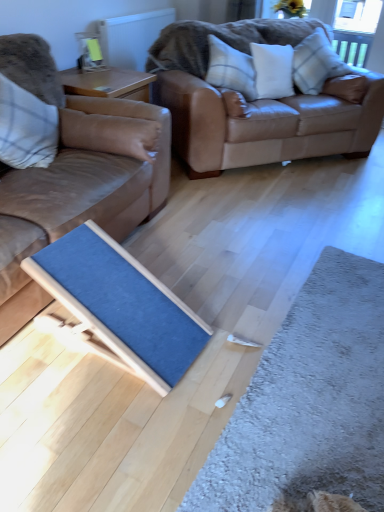
Question: Can you confirm if clear glass window screen at upper right is taller than plaid fabric pillow at upper right, placed as the 1th pillow when sorted from right to left?

Choices:
 (A) yes
 (B) no

Answer: (A)

Question: Can you confirm if clear glass window screen at upper right is shorter than plaid fabric pillow at upper right, which is the fourth pillow in left-to-right order?

Choices:
 (A) yes
 (B) no

Answer: (B)

Question: Is clear glass window screen at upper right closer to the viewer compared to plaid fabric pillow at upper right, which is the fourth pillow in left-to-right order?

Choices:
 (A) yes
 (B) no

Answer: (B)

Question: Is clear glass window screen at upper right not near plaid fabric pillow at upper right, which is the fourth pillow in left-to-right order?

Choices:
 (A) no
 (B) yes

Answer: (B)

Question: Can you see clear glass window screen at upper right touching plaid fabric pillow at upper right, which is the fourth pillow in left-to-right order?

Choices:
 (A) no
 (B) yes

Answer: (A)

Question: From a real-world perspective, is white textured radiator at upper center physically located above or below brown leather couch at upper center, which ranks as the 2th studio couch in left-to-right order?

Choices:
 (A) below
 (B) above

Answer: (B)

Question: Is white textured radiator at upper center taller or shorter than brown leather couch at upper center, which ranks as the 2th studio couch in left-to-right order?

Choices:
 (A) short
 (B) tall

Answer: (A)

Question: Looking at the image, does white textured radiator at upper center seem bigger or smaller compared to brown leather couch at upper center, which ranks as the 2th studio couch in left-to-right order?

Choices:
 (A) small
 (B) big

Answer: (A)

Question: Considering the relative positions of white textured radiator at upper center and brown leather couch at upper center, placed as the 1th studio couch when sorted from right to left, in the image provided, is white textured radiator at upper center to the left or to the right of brown leather couch at upper center, placed as the 1th studio couch when sorted from right to left,?

Choices:
 (A) left
 (B) right

Answer: (A)

Question: From the image's perspective, is plaid fabric pillow at upper right, which is the fourth pillow in left-to-right order, above or below matte brown leather couch at left, positioned as the second studio couch in right-to-left order?

Choices:
 (A) below
 (B) above

Answer: (B)

Question: In the image, is plaid fabric pillow at upper right, placed as the 1th pillow when sorted from right to left, positioned in front of or behind matte brown leather couch at left, which is the 1th studio couch in left-to-right order?

Choices:
 (A) behind
 (B) front

Answer: (A)

Question: In the image, is plaid fabric pillow at upper right, placed as the 1th pillow when sorted from right to left, on the left side or the right side of matte brown leather couch at left, positioned as the second studio couch in right-to-left order?

Choices:
 (A) left
 (B) right

Answer: (B)

Question: From a real-world perspective, relative to matte brown leather couch at left, which is the 1th studio couch in left-to-right order, is plaid fabric pillow at upper right, placed as the 1th pillow when sorted from right to left, vertically above or below?

Choices:
 (A) below
 (B) above

Answer: (B)

Question: Is matte brown leather couch at left, which is the 1th studio couch in left-to-right order, inside or outside of plaid fabric pillow at left, acting as the first pillow starting from the left?

Choices:
 (A) inside
 (B) outside

Answer: (B)

Question: Is matte brown leather couch at left, positioned as the second studio couch in right-to-left order, bigger or smaller than plaid fabric pillow at left, acting as the first pillow starting from the left?

Choices:
 (A) small
 (B) big

Answer: (B)